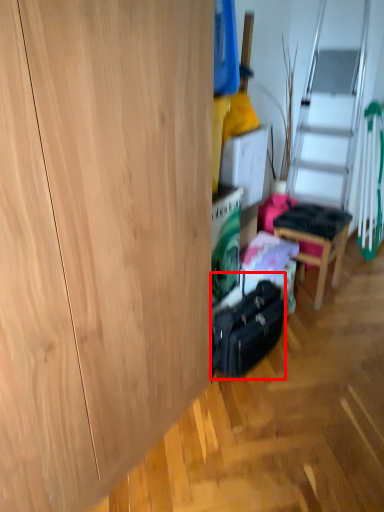
Question: From the image's perspective, where is luggage (annotated by the red box) located relative to chair?

Choices:
 (A) below
 (B) above

Answer: (A)